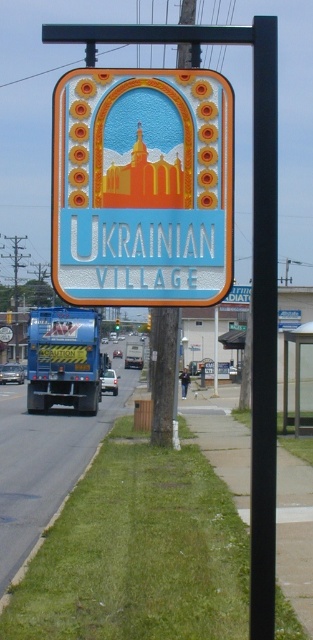
Does black metal pole at center come in front of neon yellow truck at lower left?

That is True.

Locate an element on the screen. The image size is (313, 640). black metal pole at center is located at coordinates (263, 326).

Does matte orange neon sign at upper center appear on the right side of neon yellow truck at lower left?

Yes, matte orange neon sign at upper center is to the right of neon yellow truck at lower left.

Between matte orange neon sign at upper center and neon yellow truck at lower left, which one is positioned higher?

Positioned higher is matte orange neon sign at upper center.

Who is more forward, (61, 129) or (32, 348)?

Point (61, 129)

At what (x,y) coordinates should I click in order to perform the action: click on matte orange neon sign at upper center. Please return your answer as a coordinate pair (x, y). This screenshot has height=640, width=313. Looking at the image, I should click on (142, 188).

From the picture: Is matte orange neon sign at upper center wider than black metal pole at center?

In fact, matte orange neon sign at upper center might be narrower than black metal pole at center.

Does matte orange neon sign at upper center appear on the left side of black metal pole at center?

Yes, matte orange neon sign at upper center is to the left of black metal pole at center.

The width and height of the screenshot is (313, 640). What are the coordinates of `matte orange neon sign at upper center` in the screenshot? It's located at (142, 188).

Find the location of `matte orange neon sign at upper center`. matte orange neon sign at upper center is located at coordinates (142, 188).